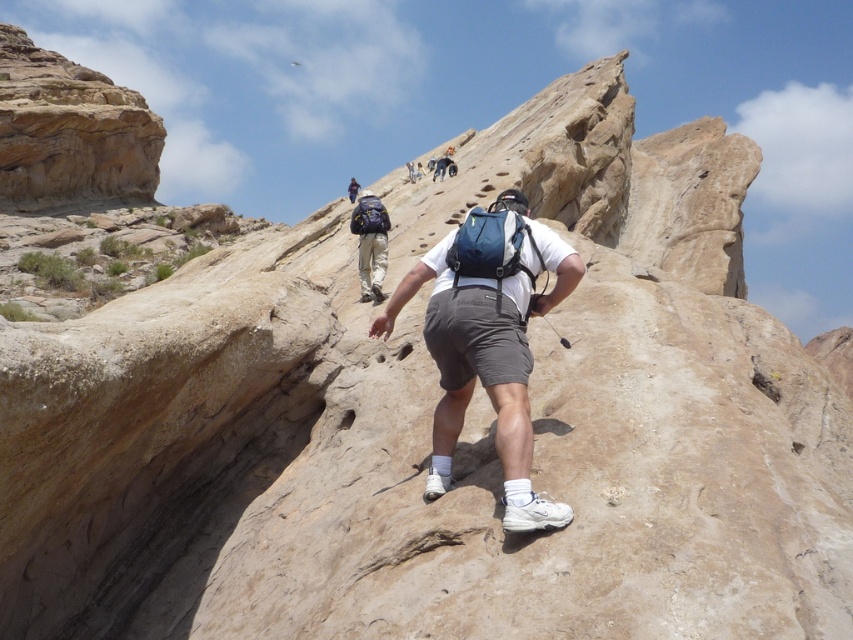
You are a hiker planning to carry both the matte blue backpack at center and the matte black backpack at upper center. Based on their sizes, which one should you choose to pack first if you want to fit both into your limited storage space?

The matte blue backpack at center occupies less space than the matte black backpack at upper center, so you should pack the matte blue backpack at center first to ensure both fit into the limited storage space.

You are a hiker planning to place a map on the ground next to your matte blue backpack at center. According to the coordinates provided, where should you place the map to ensure it stays near the backpack?

The map should be placed near the coordinates point (489, 339) where the matte blue backpack at center is located.

You are a hiker trying to decide which backpack to use for a steep climb. You notice the matte blue backpack at center and the matte black backpack at upper center in the scene. Which backpack is positioned closer to you?

The matte blue backpack at center is closer to the viewer than the matte black backpack at upper center.